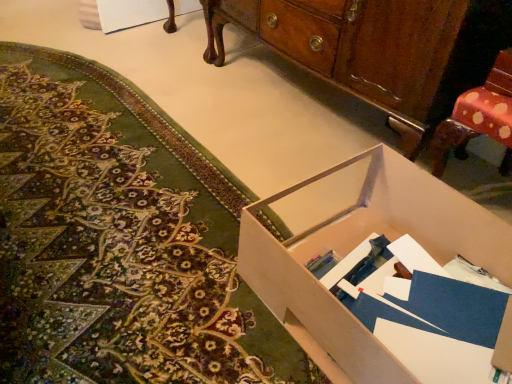
The height and width of the screenshot is (384, 512). Identify the location of vacant space underneath wooden cabinet at center (from a real-world perspective). (307, 101).